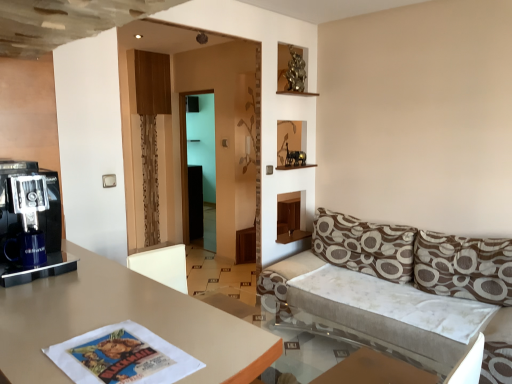
What do you see at coordinates (374, 371) in the screenshot? The width and height of the screenshot is (512, 384). I see `brown fabric armchair at lower right` at bounding box center [374, 371].

Describe the element at coordinates (463, 267) in the screenshot. I see `brown textured pillow at right, the 2th pillow in the left-to-right sequence` at that location.

Measure the distance between point (13, 292) and camera.

They are 4.01 feet apart.

The image size is (512, 384). Find the location of `brown printed cushion at right, arranged as the first pillow when viewed from the left`. brown printed cushion at right, arranged as the first pillow when viewed from the left is located at coordinates (365, 246).

Between transparent glass table at lower right and brown printed cushion at right, arranged as the first pillow when viewed from the left, which one appears on the right side from the viewer's perspective?

Positioned to the right is brown printed cushion at right, arranged as the first pillow when viewed from the left.

Considering the relative sizes of transparent glass table at lower right and brown printed cushion at right, arranged as the first pillow when viewed from the left, in the image provided, is transparent glass table at lower right wider than brown printed cushion at right, arranged as the first pillow when viewed from the left,?

Yes, transparent glass table at lower right is wider than brown printed cushion at right, arranged as the first pillow when viewed from the left.

From the image's perspective, which is below, transparent glass table at lower right or brown printed cushion at right, placed as the 2th pillow when sorted from right to left?

transparent glass table at lower right appears lower in the image.

Is point (369, 345) closer or farther from the camera than point (334, 233)?

Clearly, point (369, 345) is closer to the camera than point (334, 233).

From a real-world perspective, who is located higher, white fabric couch at right or brown fabric armchair at lower right?

brown fabric armchair at lower right, from a real-world perspective.

Image resolution: width=512 pixels, height=384 pixels. Find the location of `studio couch below the brown fabric armchair at lower right (from the image's perspective)`. studio couch below the brown fabric armchair at lower right (from the image's perspective) is located at coordinates 400,291.

Between white fabric couch at right and brown fabric armchair at lower right, which one is positioned behind?

white fabric couch at right is further away from the camera.

How different are the orientations of brown fabric armchair at lower right and matte beige table at center in degrees?

brown fabric armchair at lower right and matte beige table at center are facing 0.0307 degrees away from each other.

Is brown fabric armchair at lower right far from matte beige table at center?

brown fabric armchair at lower right is far away from matte beige table at center.

Which object is further away from the camera, brown fabric armchair at lower right or matte beige table at center?

brown fabric armchair at lower right.

Can you confirm if brown fabric armchair at lower right is positioned to the left of matte beige table at center?

In fact, brown fabric armchair at lower right is to the right of matte beige table at center.

Is transparent glass door at center bigger or smaller than brown fabric armchair at lower right?

Considering their sizes, transparent glass door at center takes up more space than brown fabric armchair at lower right.

Is transparent glass door at center positioned with its back to brown fabric armchair at lower right?

transparent glass door at center is not turned away from brown fabric armchair at lower right.

Which object is positioned more to the right, transparent glass door at center or brown fabric armchair at lower right?

From the viewer's perspective, brown fabric armchair at lower right appears more on the right side.

Can we say transparent glass door at center lies outside brown fabric armchair at lower right?

Indeed, transparent glass door at center is completely outside brown fabric armchair at lower right.

In the scene shown: Can you confirm if brown printed cushion at right, placed as the 2th pillow when sorted from right to left, is shorter than matte black coffee machine at left?

Incorrect, the height of brown printed cushion at right, placed as the 2th pillow when sorted from right to left, does not fall short of that of matte black coffee machine at left.

Which pillow is the 2nd one when counting from the back of the matte black coffee machine at left? Please provide its 2D coordinates.

[(365, 246)]

Could you tell me if brown printed cushion at right, arranged as the first pillow when viewed from the left, is facing matte black coffee machine at left?

Yes, brown printed cushion at right, arranged as the first pillow when viewed from the left, is turned towards matte black coffee machine at left.

From a real-world perspective, which object rests below the other?

From a 3D spatial view, brown printed cushion at right, arranged as the first pillow when viewed from the left, is below.

Considering their positions, is matte black coffee machine at left located in front of or behind brown fabric armchair at lower right?

In the image, matte black coffee machine at left appears behind brown fabric armchair at lower right.

In the scene shown: Can you confirm if matte black coffee machine at left is bigger than brown fabric armchair at lower right?

Indeed, matte black coffee machine at left has a larger size compared to brown fabric armchair at lower right.

Considering the relative sizes of matte black coffee machine at left and brown fabric armchair at lower right in the image provided, is matte black coffee machine at left thinner than brown fabric armchair at lower right?

No, matte black coffee machine at left is not thinner than brown fabric armchair at lower right.

Locate an element on the screen. armchair on the right side of matte black coffee machine at left is located at coordinates (374, 371).

Does matte beige table at center have a larger size compared to transparent glass table at lower right?

Correct, matte beige table at center is larger in size than transparent glass table at lower right.

Does matte beige table at center turn towards transparent glass table at lower right?

Yes, matte beige table at center is oriented towards transparent glass table at lower right.

Is matte beige table at center placed right next to transparent glass table at lower right?

No, matte beige table at center is not in contact with transparent glass table at lower right.

Where is `the 1st pillow counting from the right of the transparent glass table at lower right`? The height and width of the screenshot is (384, 512). the 1st pillow counting from the right of the transparent glass table at lower right is located at coordinates (365, 246).

Where is `studio couch lying below the brown fabric armchair at lower right (from the image's perspective)`? Image resolution: width=512 pixels, height=384 pixels. studio couch lying below the brown fabric armchair at lower right (from the image's perspective) is located at coordinates (400, 291).

Based on their spatial positions, is matte beige table at center or brown textured pillow at right, the 1th pillow when ordered from right to left, further from matte black coffee machine at left?

Based on the image, brown textured pillow at right, the 1th pillow when ordered from right to left, appears to be further to matte black coffee machine at left.

From the image, which object appears to be farther from white fabric couch at right, brown textured pillow at right, the 2th pillow in the left-to-right sequence, or matte beige table at center?

Based on the image, matte beige table at center appears to be further to white fabric couch at right.

Estimate the real-world distances between objects in this image. Which object is closer to transparent glass table at lower right, transparent glass door at center or brown printed cushion at right, placed as the 2th pillow when sorted from right to left?

brown printed cushion at right, placed as the 2th pillow when sorted from right to left.

Looking at the image, which one is located closer to matte black coffee machine at left, white fabric couch at right or brown printed cushion at right, arranged as the first pillow when viewed from the left?

Among the two, white fabric couch at right is located nearer to matte black coffee machine at left.

Estimate the real-world distances between objects in this image. Which object is closer to white fabric couch at right, matte beige table at center or brown printed cushion at right, arranged as the first pillow when viewed from the left?

Among the two, brown printed cushion at right, arranged as the first pillow when viewed from the left, is located nearer to white fabric couch at right.

Estimate the real-world distances between objects in this image. Which object is closer to matte beige table at center, transparent glass table at lower right or matte black coffee machine at left?

Based on the image, matte black coffee machine at left appears to be nearer to matte beige table at center.

Considering their positions, is white fabric couch at right positioned further to brown printed cushion at right, placed as the 2th pillow when sorted from right to left, than transparent glass door at center?

The object further to brown printed cushion at right, placed as the 2th pillow when sorted from right to left, is transparent glass door at center.

Looking at the image, which one is located closer to white fabric couch at right, brown textured pillow at right, the 1th pillow when ordered from right to left, or brown fabric armchair at lower right?

brown textured pillow at right, the 1th pillow when ordered from right to left, is closer to white fabric couch at right.

Locate an element on the screen. armchair between matte beige table at center and transparent glass door at center in the front-back direction is located at coordinates (374, 371).

At what (x,y) coordinates should I click in order to perform the action: click on studio couch located between matte beige table at center and brown printed cushion at right, arranged as the first pillow when viewed from the left, in the depth direction. Please return your answer as a coordinate pair (x, y). Image resolution: width=512 pixels, height=384 pixels. Looking at the image, I should click on (400, 291).

Identify the location of glass table between brown fabric armchair at lower right and brown textured pillow at right, the 1th pillow when ordered from right to left, in the front-back direction. (286, 340).

Find the location of a particular element. The height and width of the screenshot is (384, 512). studio couch located between brown fabric armchair at lower right and brown textured pillow at right, the 1th pillow when ordered from right to left, in the depth direction is located at coordinates (400, 291).